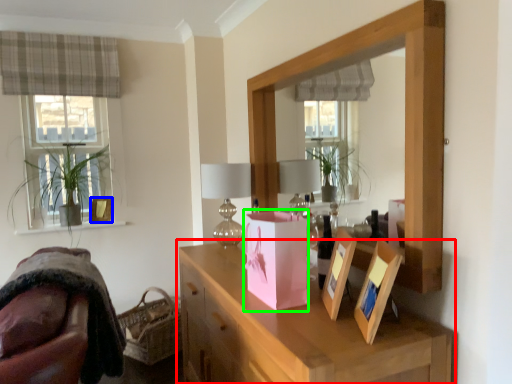
Question: Which object is the farthest from cabinetry (highlighted by a red box)? Choose among these: picture frame (highlighted by a blue box) or package (highlighted by a green box).

Choices:
 (A) picture frame
 (B) package

Answer: (A)